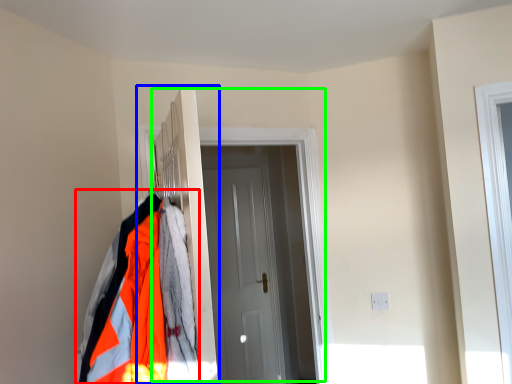
Question: Based on their relative distances, which object is nearer to jacket (highlighted by a red box)? Choose from closet (highlighted by a blue box) and door (highlighted by a green box).

Choices:
 (A) closet
 (B) door

Answer: (A)